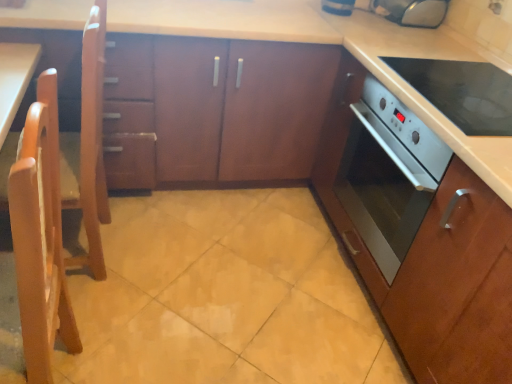
Question: Based on their positions, is wooden cabinet at center, acting as the 2th cabinetry starting from the right, located to the left or right of satin wood oven at center, marked as the second cabinetry in a left-to-right arrangement?

Choices:
 (A) right
 (B) left

Answer: (B)

Question: Which is correct: wooden cabinet at center, acting as the 2th cabinetry starting from the right, is inside satin wood oven at center, marked as the second cabinetry in a left-to-right arrangement, or outside of it?

Choices:
 (A) outside
 (B) inside

Answer: (A)

Question: Which of these objects is positioned farthest from the blue glossy toaster at upper center, which is counted as the 1th appliance, starting from the left?

Choices:
 (A) white glossy oven at right
 (B) metallic silver toaster at upper right, the first appliance in the right-to-left sequence
 (C) yellow matte tile at center
 (D) satin wood oven at center, acting as the first cabinetry starting from the right
 (E) light wood chair at left, the second chair viewed from the back

Answer: (E)

Question: Considering the real-world distances, which object is closest to the light wood chair at left, the 1th chair when ordered from front to back?

Choices:
 (A) satin wood oven at center, marked as the second cabinetry in a left-to-right arrangement
 (B) light wood chair at left, the 1th chair from the back
 (C) blue glossy toaster at upper center, which is counted as the 1th appliance, starting from the left
 (D) yellow matte tile at center
 (E) white glossy oven at right

Answer: (B)